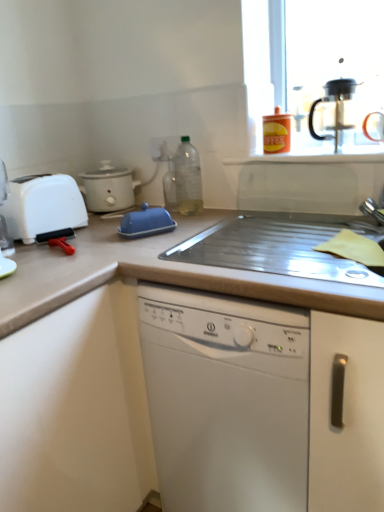
You are a GUI agent. You are given a task and a screenshot of the screen. Output one action in this format:
    pyautogui.click(x=<x>, y=<y>)
    Task: Click on the unoccupied space behind black plastic coffee machine at upper right
    
    Given the screenshot: What is the action you would take?
    329,144